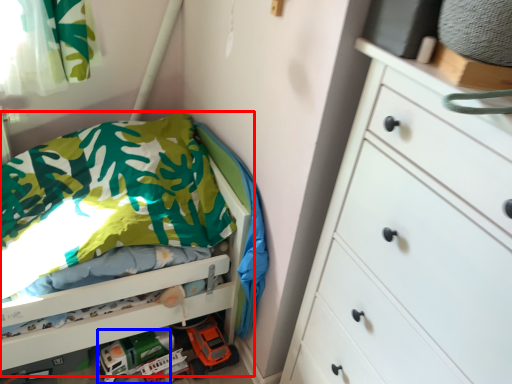
Question: Which object appears closest to the camera in this image, bed (highlighted by a red box) or toy car (highlighted by a blue box)?

Choices:
 (A) bed
 (B) toy car

Answer: (A)